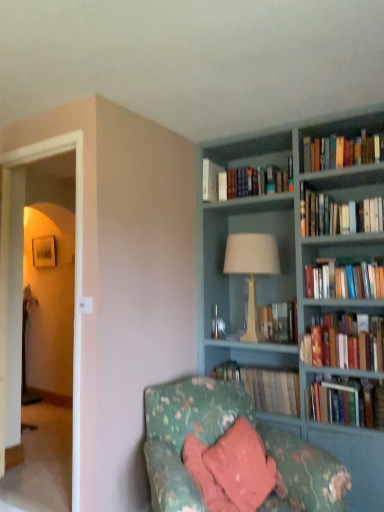
Question: Is floral fabric couch at lower right thinner than hardcover books at upper center, the 7th book from the bottom?

Choices:
 (A) yes
 (B) no

Answer: (B)

Question: Does floral fabric couch at lower right have a smaller size compared to hardcover books at upper center, the 7th book from the bottom?

Choices:
 (A) no
 (B) yes

Answer: (A)

Question: Considering the relative sizes of floral fabric couch at lower right and hardcover books at upper center, the 7th book from the bottom, in the image provided, is floral fabric couch at lower right taller than hardcover books at upper center, the 7th book from the bottom,?

Choices:
 (A) yes
 (B) no

Answer: (A)

Question: Can you confirm if floral fabric couch at lower right is shorter than hardcover books at upper center, the 7th book from the bottom?

Choices:
 (A) yes
 (B) no

Answer: (B)

Question: Is floral fabric couch at lower right far from hardcover books at upper center, positioned as the third book in top-to-bottom order?

Choices:
 (A) no
 (B) yes

Answer: (B)

Question: In terms of height, does hardcover book at center, the 8th book viewed from the top, look taller or shorter compared to teal painted wood bookcase at upper right?

Choices:
 (A) tall
 (B) short

Answer: (B)

Question: Would you say hardcover book at center, the 8th book viewed from the top, is inside or outside teal painted wood bookcase at upper right?

Choices:
 (A) inside
 (B) outside

Answer: (A)

Question: Based on their sizes in the image, would you say hardcover book at center, which ranks as the 2th book in bottom-to-top order, is bigger or smaller than teal painted wood bookcase at upper right?

Choices:
 (A) big
 (B) small

Answer: (B)

Question: Is hardcover book at center, which ranks as the 2th book in bottom-to-top order, wider or thinner than teal painted wood bookcase at upper right?

Choices:
 (A) wide
 (B) thin

Answer: (B)

Question: In the image, is hardcover books at upper center, the 7th book from the bottom, on the left side or the right side of floral fabric couch at lower right?

Choices:
 (A) left
 (B) right

Answer: (B)

Question: Looking at their shapes, would you say hardcover books at upper center, positioned as the third book in top-to-bottom order, is wider or thinner than floral fabric couch at lower right?

Choices:
 (A) thin
 (B) wide

Answer: (A)

Question: Do you think hardcover books at upper center, positioned as the third book in top-to-bottom order, is within floral fabric couch at lower right, or outside of it?

Choices:
 (A) inside
 (B) outside

Answer: (B)

Question: From a real-world perspective, is hardcover books at upper center, positioned as the third book in top-to-bottom order, positioned above or below floral fabric couch at lower right?

Choices:
 (A) below
 (B) above

Answer: (B)

Question: Based on their positions, is white fabric lampshade at center located to the left or right of hardcover books at center, the fourth book in the bottom-to-top sequence?

Choices:
 (A) left
 (B) right

Answer: (A)

Question: Relative to hardcover books at center, the 6th book positioned from the top, is white fabric lampshade at center in front or behind?

Choices:
 (A) front
 (B) behind

Answer: (A)